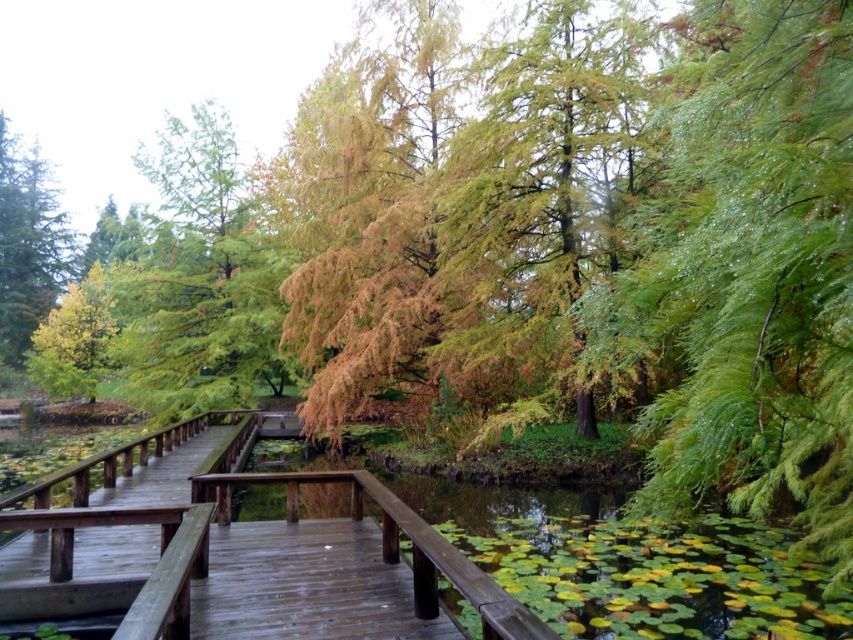
Describe the element at coordinates (228, 557) in the screenshot. I see `wooden bridge at center` at that location.

Find the location of `wooden bridge at center`. wooden bridge at center is located at coordinates (228, 557).

What do you see at coordinates (228, 557) in the screenshot?
I see `wooden bridge at center` at bounding box center [228, 557].

You are a GUI agent. You are given a task and a screenshot of the screen. Output one action in this format:
    pyautogui.click(x=<x>, y=<y>)
    Task: Click on the wooden bridge at center
    
    Given the screenshot: What is the action you would take?
    click(x=228, y=557)

Which of these two, green matte tree at left or yellow-green foliage at left, stands taller?

With more height is green matte tree at left.

Is green matte tree at left to the right of yellow-green foliage at left from the viewer's perspective?

In fact, green matte tree at left is to the left of yellow-green foliage at left.

Does point (20, 237) come in front of point (86, 320)?

No.

Identify the location of green matte tree at left. (28, 244).

Does green glossy leaves at right have a greater width compared to green matte tree at left?

No.

This screenshot has width=853, height=640. Find the location of `green glossy leaves at right`. green glossy leaves at right is located at coordinates (749, 273).

Is point (770, 372) positioned after point (62, 260)?

No, (770, 372) is in front of (62, 260).

The image size is (853, 640). I want to click on green glossy leaves at right, so tap(749, 273).